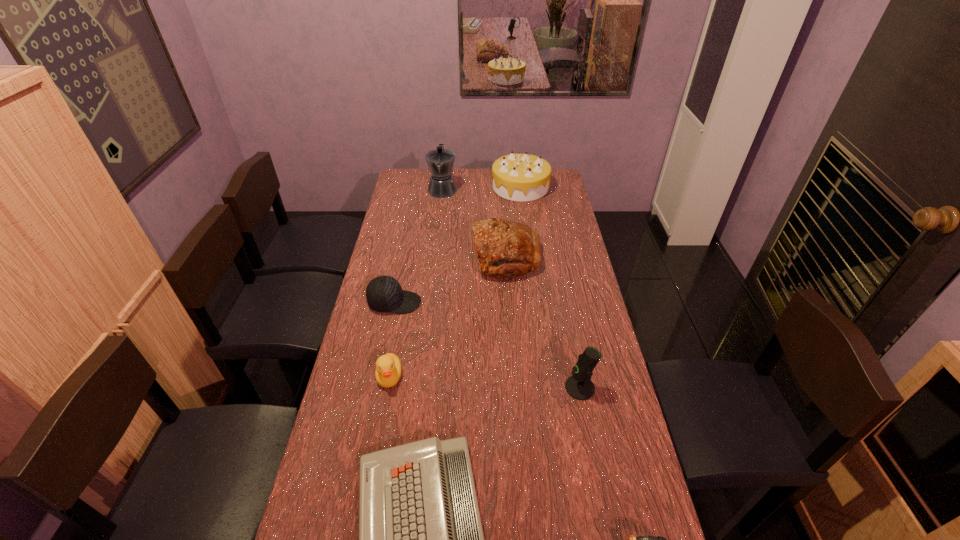
Where is `object that stands as the fifth closest to the birthday cake`? object that stands as the fifth closest to the birthday cake is located at coordinates (579, 386).

This screenshot has height=540, width=960. I want to click on the seventh closest object to the coffeepot, so click(x=631, y=539).